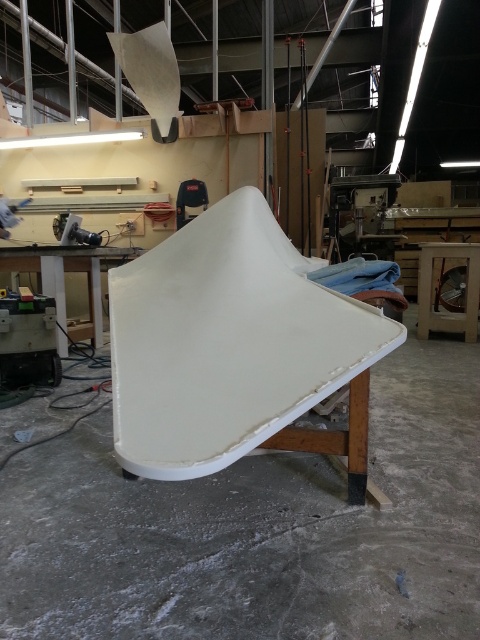
Does white matte surfboard at center appear over white matte workbench at left?

Incorrect, white matte surfboard at center is not positioned above white matte workbench at left.

Can you confirm if white matte surfboard at center is smaller than white matte workbench at left?

Yes, white matte surfboard at center is smaller than white matte workbench at left.

The height and width of the screenshot is (640, 480). I want to click on white matte surfboard at center, so click(235, 349).

Where is `white matte surfboard at center`? This screenshot has width=480, height=640. white matte surfboard at center is located at coordinates (235, 349).